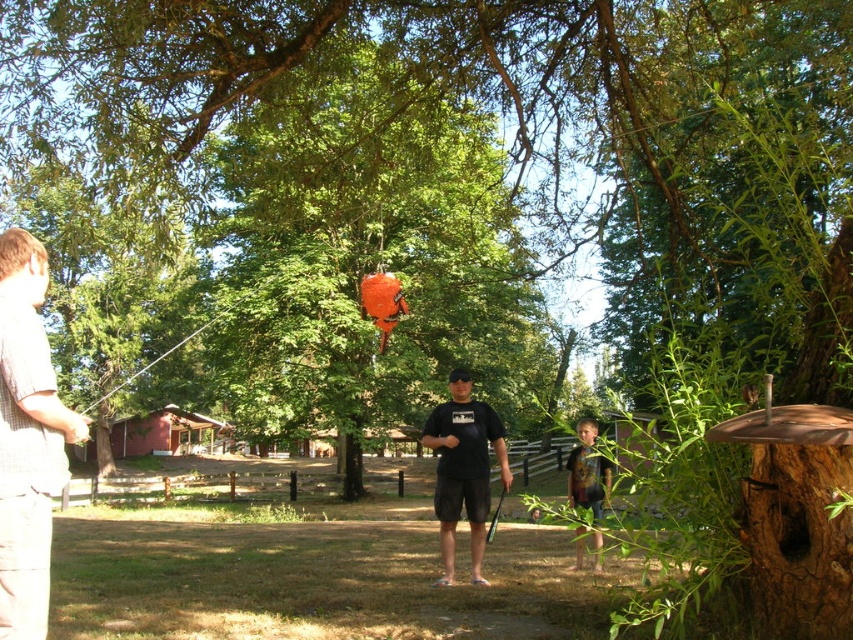
You are a photographer setting up for a group photo. You need to position two people wearing the plaid shirt at left and the multicolored fabric shirt at lower right so that they are exactly 3 meters apart. Can you adjust their current positions to meet this requirement?

The plaid shirt at left and multicolored fabric shirt at lower right are currently 4.56 meters apart. To meet the requirement of 3 meters, you need to move them closer by 1.56 meters.

You are a photographer setting up for a group photo. You notice two people in the scene wearing the plaid shirt at left and the multicolored fabric shirt at lower right. Which person should you position closer to the camera to maintain their visibility in the photo?

The plaid shirt at left is already closer to the viewer than the multicolored fabric shirt at lower right, so positioning the person in the plaid shirt at left closer to the camera will maintain their visibility as they are already nearer.